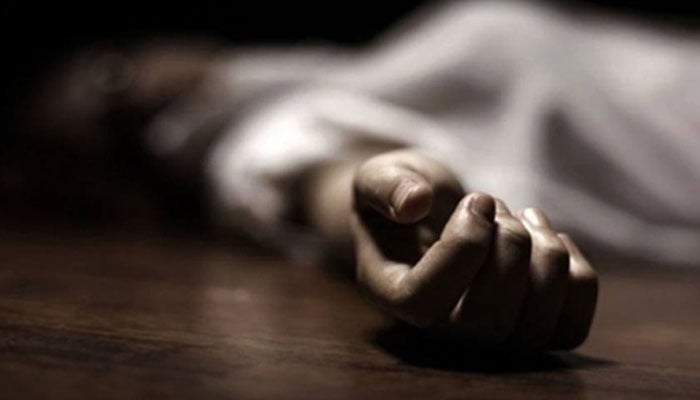
Image resolution: width=700 pixels, height=400 pixels. I want to click on chest, so click(470, 40).